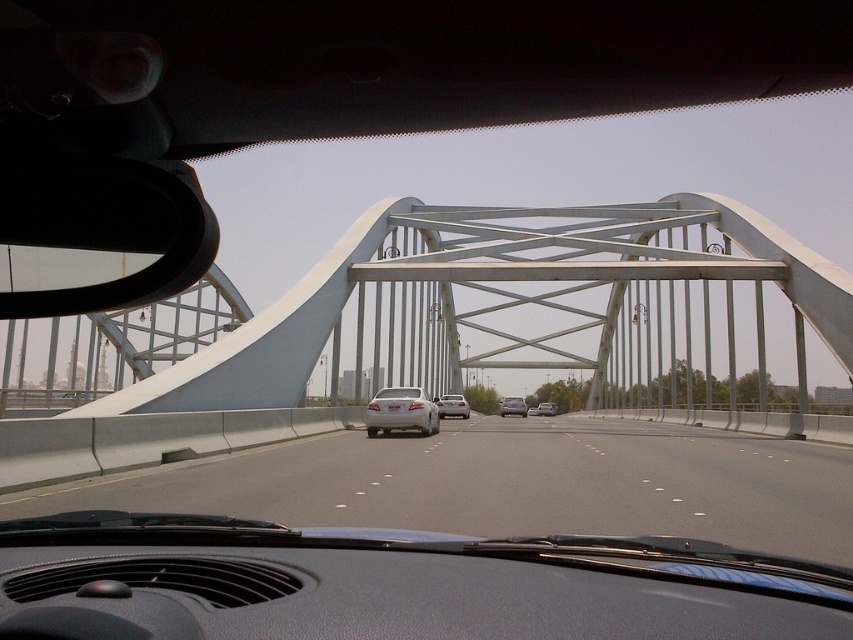
You are driving a car and want to know if the white metallic bridge at center can accommodate the width of your white matte sedan at center. Can it?

The white metallic bridge at center is wider than the white matte sedan at center, so it can accommodate the sedan.

You are driving a car and want to know which car in front of you is closer. You see a white matte sedan at center and a satin silver sedan at center. Which one is closer to your vehicle?

The white matte sedan at center is closer to your vehicle because it appears larger in size than the satin silver sedan at center.

In the scene shown: You are driving a car and want to change lanes to the right. Looking at the scene, can you see the gray asphalt highway at center to the right of the white glossy sedan at center? If yes, is there enough space to safely move into that lane?

Yes, the gray asphalt highway at center is to the right of the white glossy sedan at center. However, the description does not provide information about the distance or space between the two, so it is unclear if there is enough space to safely change lanes.